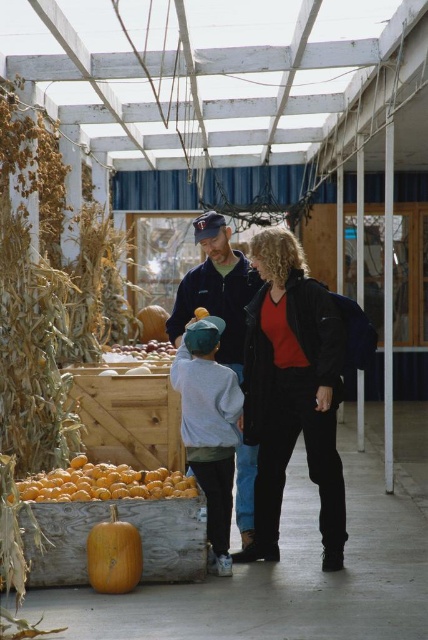
You are standing in the market and want to pick up an item located at point (228, 545) and another item at point (143, 339). Which item will be easier to reach without moving your position?

The item at point (228, 545) will be easier to reach because it is closer to you than the item at point (143, 339).

You are a customer at the rustic indoor market and want to find the black matte jacket at center. Based on the coordinates provided, where should you look relative to the wooden crate filled with small pumpkins?

The black matte jacket at center is located at coordinates point (291, 392), which is to the right of the wooden crate filled with small pumpkins since the x coordinate is higher than the crate.